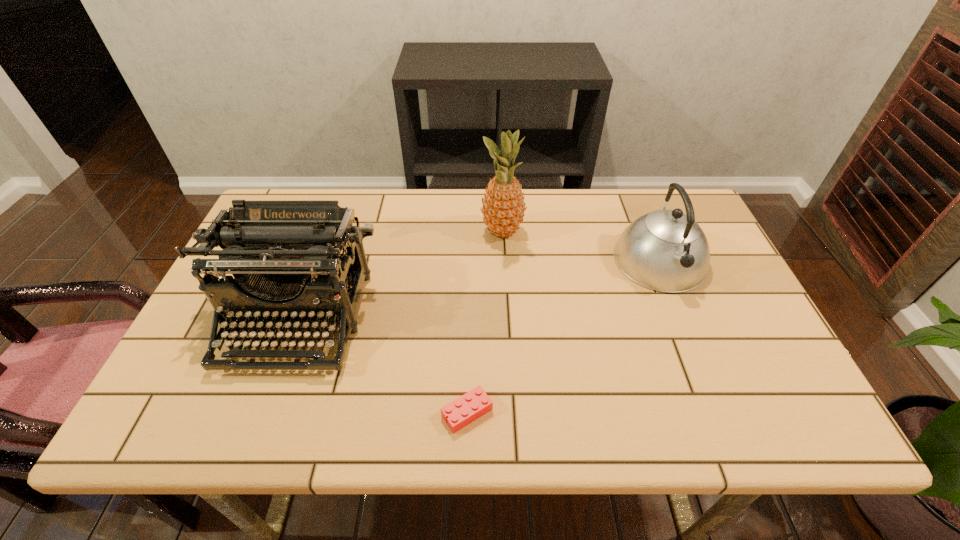
The image size is (960, 540). What are the coordinates of `vacant position in the image that satisfies the following two spatial constraints: 1. on the typing side of the nearest object; 2. on the left side of the typewriter` in the screenshot? It's located at (262, 413).

Locate an element on the screen. vacant area that satisfies the following two spatial constraints: 1. on the typing side of the typewriter; 2. on the right side of the shortest object is located at coordinates (262, 413).